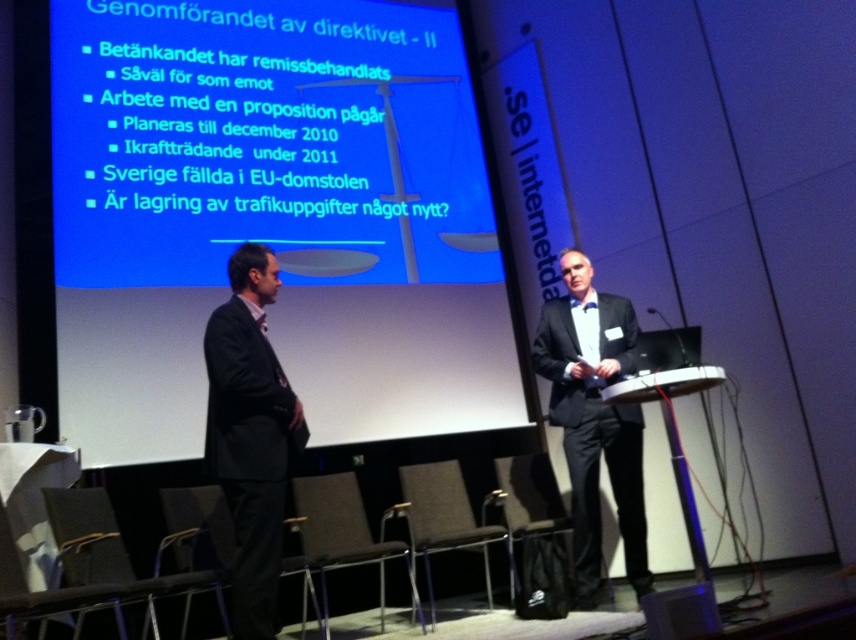
Based on the provided scene description, where is the blue matte projection screen at upper center located in terms of its 2D coordinates?

The blue matte projection screen at upper center is located at the 2D coordinates point (272, 218).

You are an event organizer who needs to ensure that the blue matte projection screen at upper center and the blue plastic speaker at lower right are positioned correctly for the presentation. Based on their sizes, which object should be placed higher to ensure proper visibility and audio quality?

The blue matte projection screen at upper center should be placed higher because it is much taller than the blue plastic speaker at lower right, ensuring better visibility for the audience while the speaker remains at a suitable height for audio distribution.